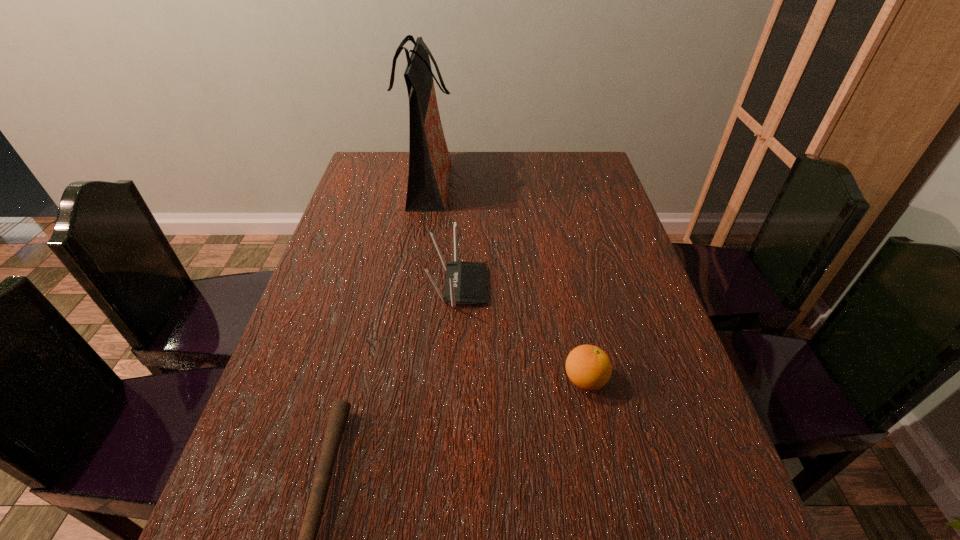
Identify the location of the closest object to the orange. (466, 282).

Locate an element on the screen. The height and width of the screenshot is (540, 960). free space that satisfies the following two spatial constraints: 1. on the front-facing side of the router; 2. on the back side of the third tallest object is located at coordinates (454, 380).